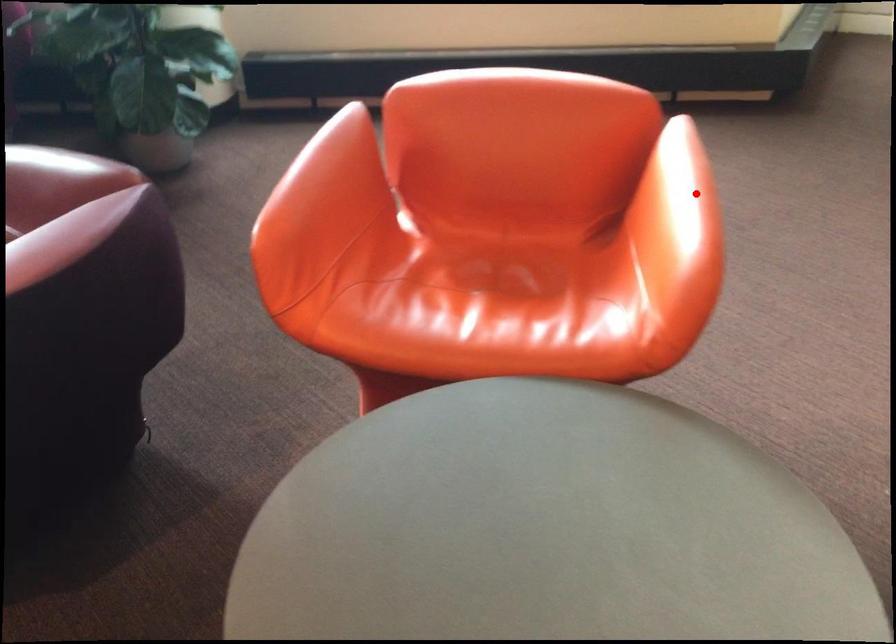
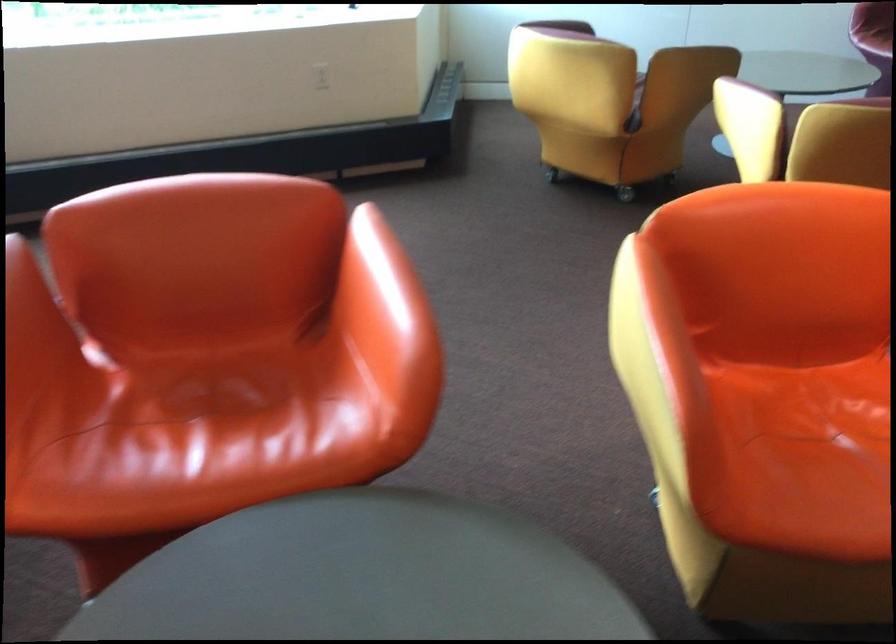
Find the pixel in the second image that matches the highlighted location in the first image.

(397, 283)